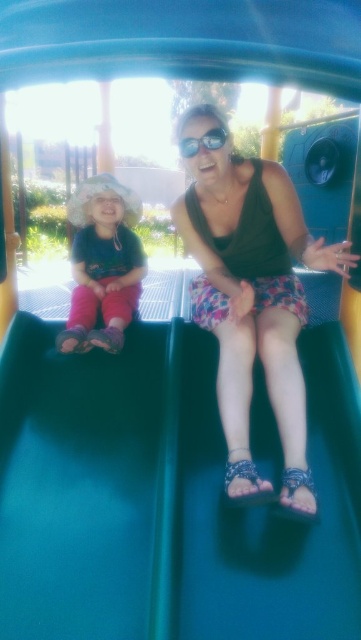
Does green smooth slide at center appear on the right side of matte brown tank top at center?

In fact, green smooth slide at center is to the left of matte brown tank top at center.

Does point (337, 604) lie behind point (286, 449)?

No, it is not.

The height and width of the screenshot is (640, 361). Find the location of `green smooth slide at center`. green smooth slide at center is located at coordinates (164, 497).

Can you confirm if green smooth slide at center is wider than matte pink pants at left?

Yes, green smooth slide at center is wider than matte pink pants at left.

Does green smooth slide at center lie behind matte pink pants at left?

No, green smooth slide at center is in front of matte pink pants at left.

Find the location of a particular element. The image size is (361, 640). green smooth slide at center is located at coordinates (164, 497).

Who is positioned more to the right, matte brown tank top at center or shiny black goggles at center?

From the viewer's perspective, matte brown tank top at center appears more on the right side.

Is point (250, 262) farther from viewer compared to point (210, 131)?

Yes, point (250, 262) is behind point (210, 131).

Does point (299, 432) come farther from viewer compared to point (188, 140)?

That is False.

Locate an element on the screen. The height and width of the screenshot is (640, 361). matte brown tank top at center is located at coordinates (251, 298).